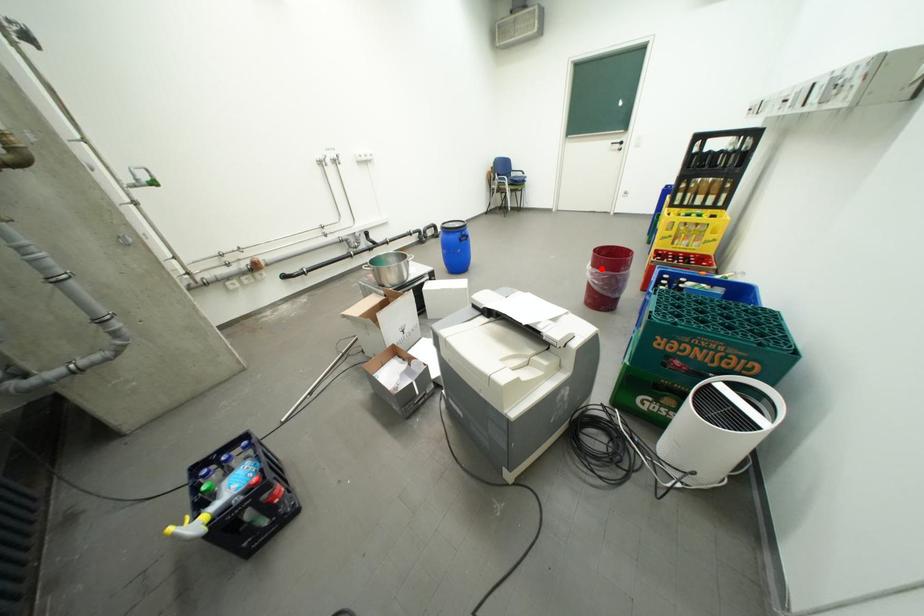
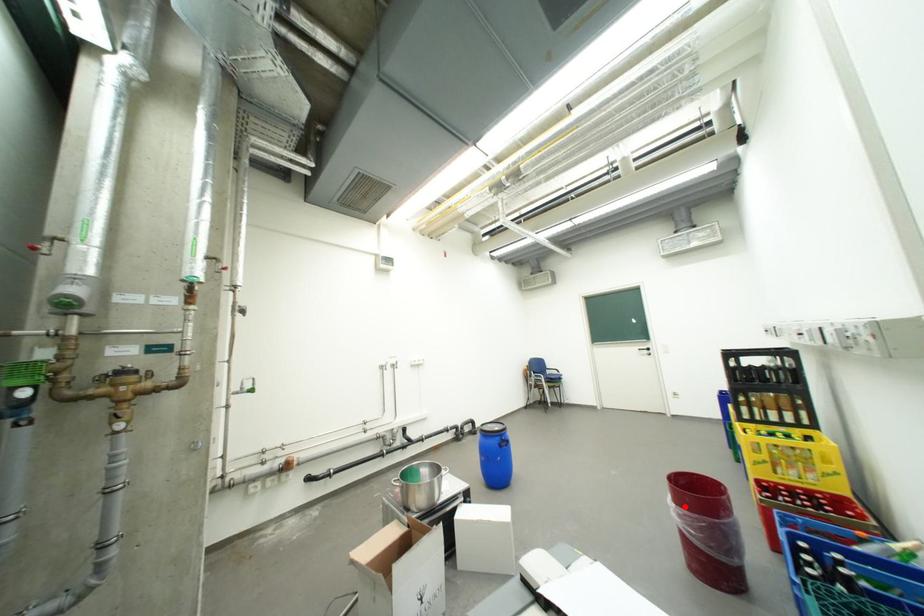
I am providing you with two images of the same scene from different viewpoints. A red point is marked on the first image and another point is marked on the second image. Is the marked point in image1 the same physical position as the marked point in image2?

Yes